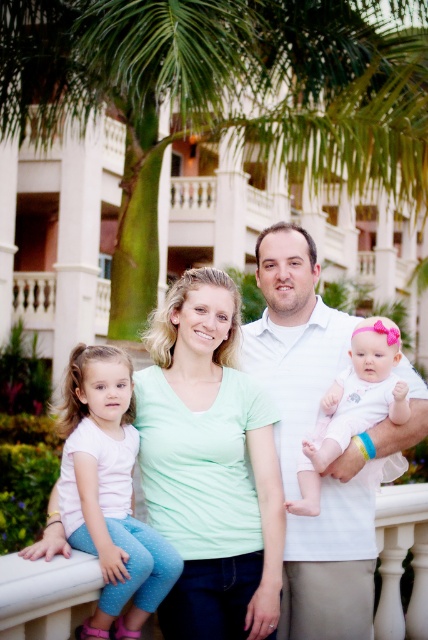
You are a photographer trying to capture a clear photo of the family. You notice the white soft fabric baby at center and the white cotton shirt at center. Which one is closer to the camera?

The white cotton shirt at center is closer to the camera because the white soft fabric baby at center is behind it.

You are a photographer standing 10 feet away from the family. You want to take a closeup photo of the white cotton shirt at center and the pink fabric baby at center. Can you focus on both subjects without adjusting your camera focus?

The white cotton shirt at center is 8.90 inches away from the pink fabric baby at center. Since the distance between them is less than 10 feet, the camera can likely focus on both subjects without needing adjustment.